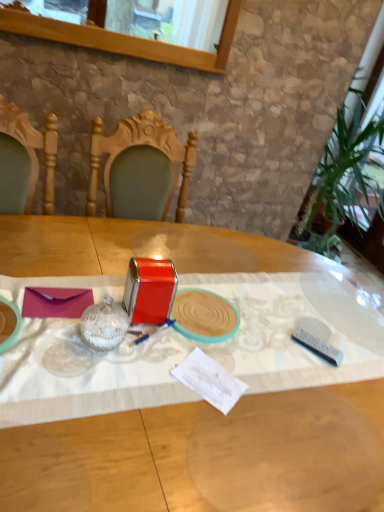
Question: Should I look upward or downward to see metallic red tin at center, marked as the third tableware in a left-to-right arrangement?

Choices:
 (A) down
 (B) up

Answer: (A)

Question: Is metallic red tin at center bigger than purple matte envelope at center?

Choices:
 (A) no
 (B) yes

Answer: (B)

Question: Is there a large distance between metallic red tin at center and purple matte envelope at center?

Choices:
 (A) no
 (B) yes

Answer: (A)

Question: Is metallic red tin at center oriented away from purple matte envelope at center?

Choices:
 (A) no
 (B) yes

Answer: (A)

Question: From the image's perspective, would you say metallic red tin at center is shown under purple matte envelope at center?

Choices:
 (A) yes
 (B) no

Answer: (A)

Question: From a real-world perspective, does metallic red tin at center stand above purple matte envelope at center?

Choices:
 (A) no
 (B) yes

Answer: (A)

Question: Considering the relative sizes of metallic red tin at center and purple matte envelope at center in the image provided, is metallic red tin at center taller than purple matte envelope at center?

Choices:
 (A) yes
 (B) no

Answer: (A)

Question: Considering the relative sizes of clear glass jar at center, acting as the 1th tableware starting from the left, and metallic red tin at center, positioned as the second tableware in left-to-right order, in the image provided, is clear glass jar at center, acting as the 1th tableware starting from the left, thinner than metallic red tin at center, positioned as the second tableware in left-to-right order,?

Choices:
 (A) no
 (B) yes

Answer: (B)

Question: Is clear glass jar at center, acting as the 1th tableware starting from the left, to the left of metallic red tin at center, the third tableware from the right, from the viewer's perspective?

Choices:
 (A) no
 (B) yes

Answer: (B)

Question: Considering the relative positions of clear glass jar at center, acting as the 4th tableware starting from the right, and metallic red tin at center, positioned as the second tableware in left-to-right order, in the image provided, is clear glass jar at center, acting as the 4th tableware starting from the right, to the right of metallic red tin at center, positioned as the second tableware in left-to-right order, from the viewer's perspective?

Choices:
 (A) no
 (B) yes

Answer: (A)

Question: Considering the relative sizes of clear glass jar at center, acting as the 1th tableware starting from the left, and metallic red tin at center, positioned as the second tableware in left-to-right order, in the image provided, is clear glass jar at center, acting as the 1th tableware starting from the left, wider than metallic red tin at center, positioned as the second tableware in left-to-right order,?

Choices:
 (A) no
 (B) yes

Answer: (A)

Question: Is clear glass jar at center, acting as the 1th tableware starting from the left, touching metallic red tin at center, the third tableware from the right?

Choices:
 (A) yes
 (B) no

Answer: (A)

Question: Is there a large distance between clear glass jar at center, acting as the 4th tableware starting from the right, and metallic red tin at center, the third tableware from the right?

Choices:
 (A) no
 (B) yes

Answer: (A)

Question: From a real-world perspective, is white plastic remote at lower right, acting as the 4th tableware starting from the left, on clear glass window at upper center?

Choices:
 (A) no
 (B) yes

Answer: (A)